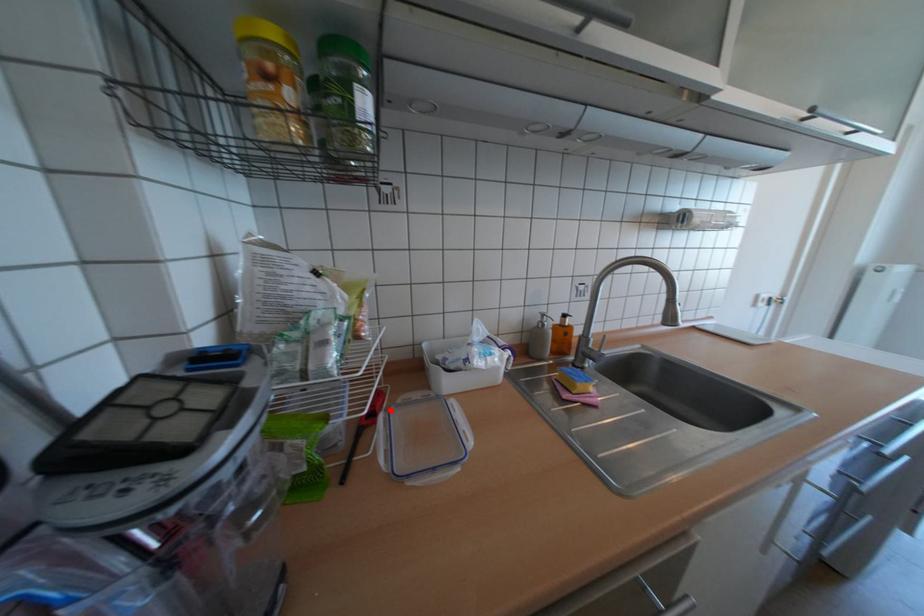
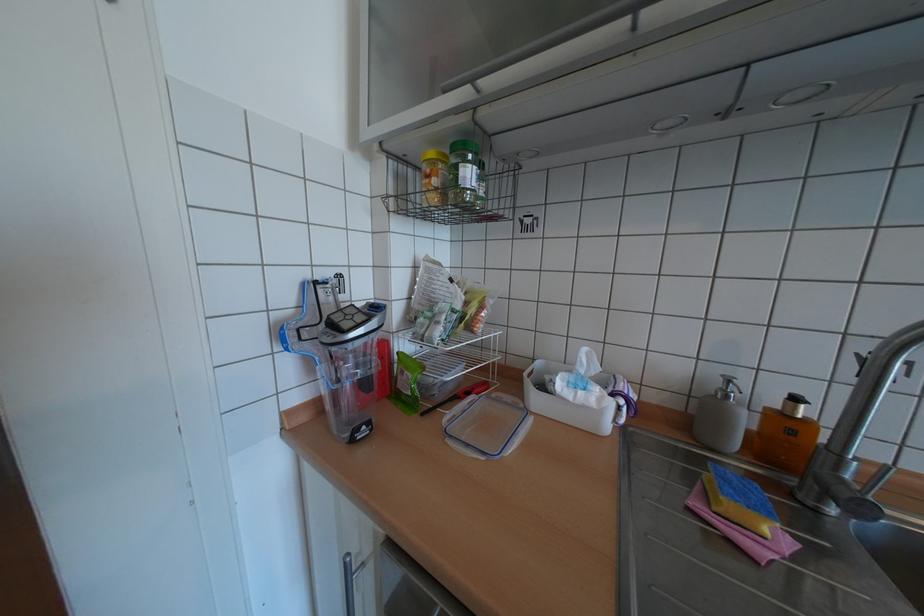
Find the pixel in the second image that matches the highlighted location in the first image.

(487, 394)